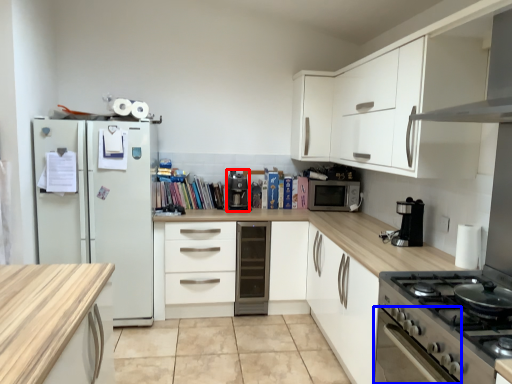
Question: Which object appears farthest to the camera in this image, coffee machine (highlighted by a red box) or oven (highlighted by a blue box)?

Choices:
 (A) coffee machine
 (B) oven

Answer: (A)